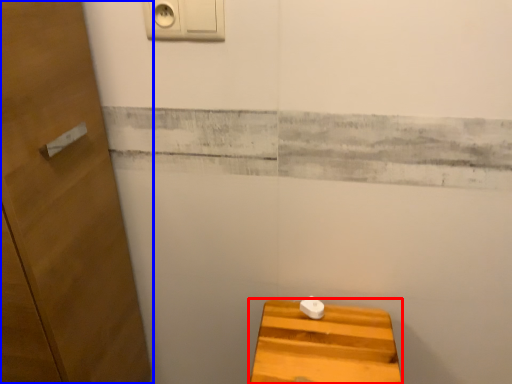
Question: Among these objects, which one is farthest to the camera, furniture (highlighted by a red box) or door (highlighted by a blue box)?

Choices:
 (A) furniture
 (B) door

Answer: (A)